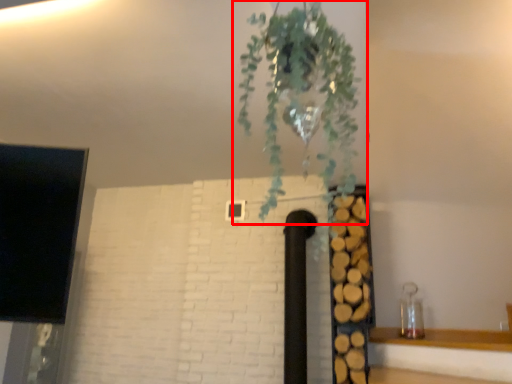
Question: From the image's perspective, what is the correct spatial positioning of houseplant (annotated by the red box) in reference to shelf?

Choices:
 (A) above
 (B) below

Answer: (A)